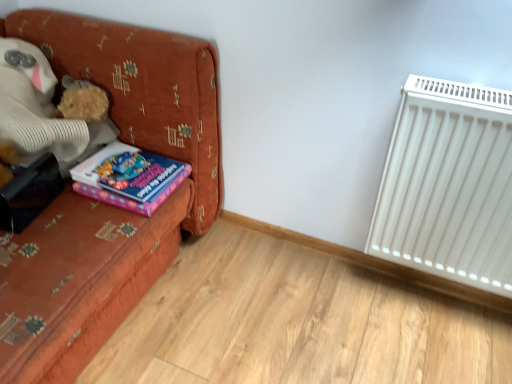
Question: Considering the relative positions of fluffy beige teddy bear at left and white plastic radiator at right in the image provided, is fluffy beige teddy bear at left to the right of white plastic radiator at right from the viewer's perspective?

Choices:
 (A) no
 (B) yes

Answer: (A)

Question: Does fluffy beige teddy bear at left have a lesser height compared to white plastic radiator at right?

Choices:
 (A) yes
 (B) no

Answer: (A)

Question: Is fluffy beige teddy bear at left closer to camera compared to white plastic radiator at right?

Choices:
 (A) no
 (B) yes

Answer: (A)

Question: Can you confirm if fluffy beige teddy bear at left is wider than white plastic radiator at right?

Choices:
 (A) no
 (B) yes

Answer: (B)

Question: Considering the relative sizes of fluffy beige teddy bear at left and white plastic radiator at right in the image provided, is fluffy beige teddy bear at left smaller than white plastic radiator at right?

Choices:
 (A) yes
 (B) no

Answer: (B)

Question: Is purple matte book at left wider or thinner than white plastic radiator at right?

Choices:
 (A) thin
 (B) wide

Answer: (B)

Question: Is purple matte book at left taller or shorter than white plastic radiator at right?

Choices:
 (A) short
 (B) tall

Answer: (A)

Question: From a real-world perspective, is purple matte book at left positioned above or below white plastic radiator at right?

Choices:
 (A) below
 (B) above

Answer: (A)

Question: Based on their sizes in the image, would you say purple matte book at left is bigger or smaller than white plastic radiator at right?

Choices:
 (A) small
 (B) big

Answer: (A)

Question: Would you say fluffy beige teddy bear at left is inside or outside white plastic radiator at right?

Choices:
 (A) outside
 (B) inside

Answer: (A)

Question: In the image, is fluffy beige teddy bear at left positioned in front of or behind white plastic radiator at right?

Choices:
 (A) behind
 (B) front

Answer: (A)

Question: From the image's perspective, is fluffy beige teddy bear at left positioned above or below white plastic radiator at right?

Choices:
 (A) above
 (B) below

Answer: (A)

Question: From their relative heights in the image, would you say fluffy beige teddy bear at left is taller or shorter than white plastic radiator at right?

Choices:
 (A) tall
 (B) short

Answer: (B)

Question: From a real-world perspective, relative to velvet orange couch at left, is purple matte book at left vertically above or below?

Choices:
 (A) above
 (B) below

Answer: (A)

Question: Based on their positions, is purple matte book at left located to the left or right of velvet orange couch at left?

Choices:
 (A) right
 (B) left

Answer: (A)